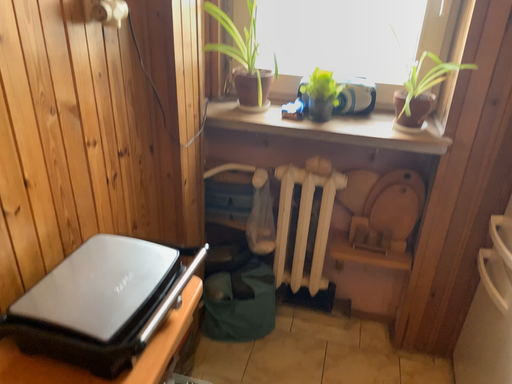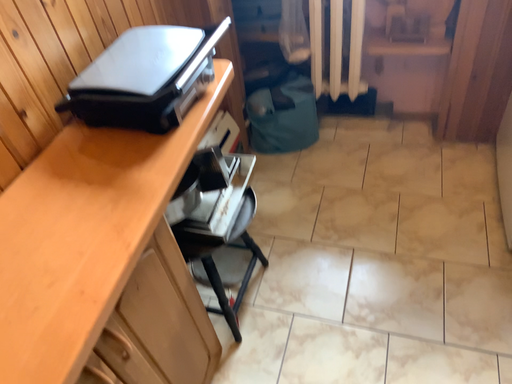
Question: How did the camera likely rotate when shooting the video?

Choices:
 (A) rotated right
 (B) rotated left

Answer: (B)